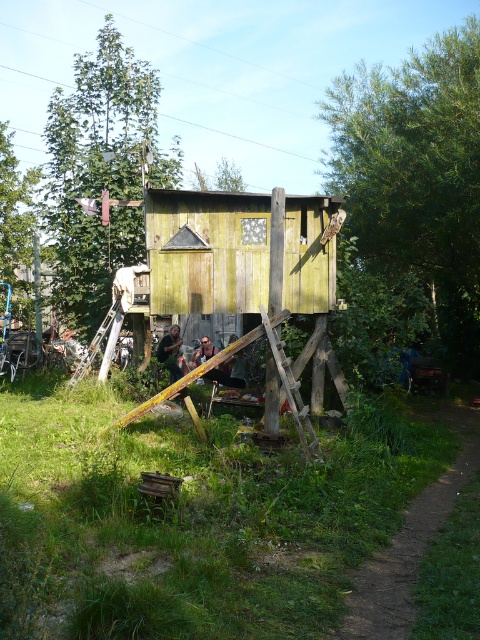
Question: Is green weathered wood hut at center in front of green wood tree at upper left?

Choices:
 (A) yes
 (B) no

Answer: (A)

Question: Which point is farther to the camera?

Choices:
 (A) (300, 225)
 (B) (479, 129)
 (C) (22, 429)

Answer: (B)

Question: Is green grass at lower center positioned behind green leafy tree at upper right?

Choices:
 (A) no
 (B) yes

Answer: (A)

Question: Which object is closer to the camera taking this photo?

Choices:
 (A) green wood tree at upper left
 (B) green leafy tree at upper left

Answer: (B)

Question: Which point is closer to the camera taking this photo?

Choices:
 (A) (224, 218)
 (B) (82, 308)

Answer: (A)

Question: Does green leafy tree at upper left have a larger size compared to green weathered wood hut at center?

Choices:
 (A) no
 (B) yes

Answer: (B)